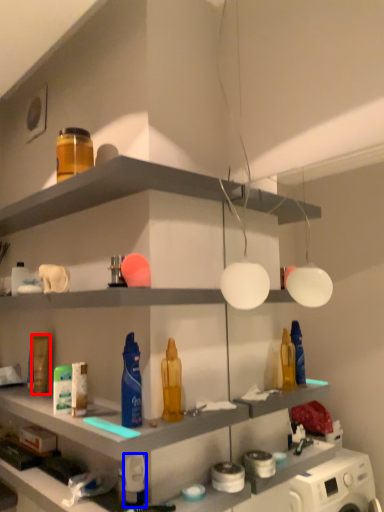
Question: Among these objects, which one is nearest to the camera, toiletry (highlighted by a red box) or toiletry (highlighted by a blue box)?

Choices:
 (A) toiletry
 (B) toiletry

Answer: (B)